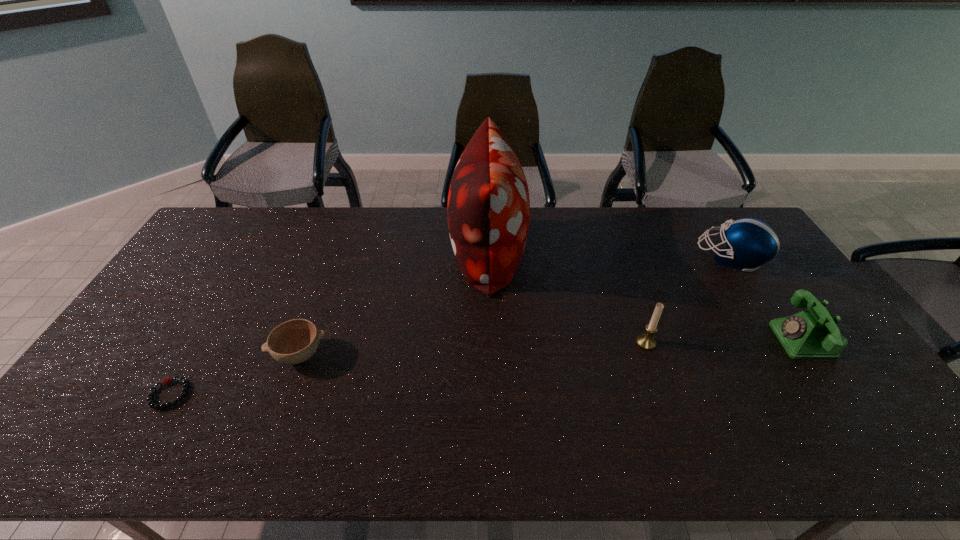
Locate an element on the screen. vacant space located 0.160m on the left of the nearest object is located at coordinates (86, 394).

Identify the location of cushion that is at the far edge. The width and height of the screenshot is (960, 540). (488, 210).

Image resolution: width=960 pixels, height=540 pixels. I want to click on football helmet at the far edge, so click(x=750, y=242).

Locate an element on the screen. This screenshot has height=540, width=960. object that is at the left edge is located at coordinates (168, 380).

Locate an element on the screen. This screenshot has width=960, height=540. football helmet located in the right edge section of the desktop is located at coordinates [x=750, y=242].

Locate an element on the screen. telephone located at the right edge is located at coordinates (813, 334).

The width and height of the screenshot is (960, 540). I want to click on object that is at the far right corner, so click(750, 242).

This screenshot has height=540, width=960. In the image, there is a desktop. What are the coordinates of `vacant space at the far edge` in the screenshot? It's located at (585, 224).

The width and height of the screenshot is (960, 540). Identify the location of vacant region at the near edge of the desktop. (494, 435).

Identify the location of vacant position at the left edge of the desktop. Image resolution: width=960 pixels, height=540 pixels. (204, 293).